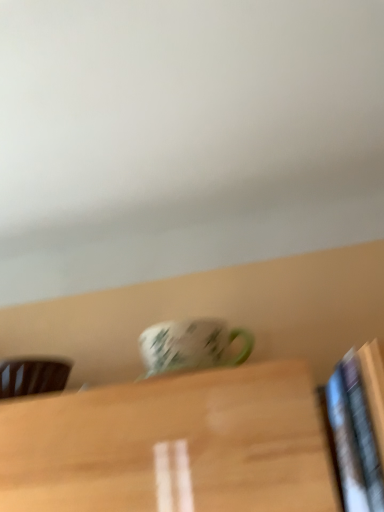
Question: Considering the positions of green matte mug at center and brown wood chair at left in the image, is green matte mug at center bigger or smaller than brown wood chair at left?

Choices:
 (A) small
 (B) big

Answer: (B)

Question: Is point (198, 353) positioned closer to the camera than point (59, 377)?

Choices:
 (A) farther
 (B) closer

Answer: (B)

Question: Is green matte mug at center in front of or behind brown wood chair at left in the image?

Choices:
 (A) front
 (B) behind

Answer: (A)

Question: Is brown wood chair at left taller or shorter than green matte mug at center?

Choices:
 (A) short
 (B) tall

Answer: (A)

Question: Is point (29, 390) positioned closer to the camera than point (198, 366)?

Choices:
 (A) closer
 (B) farther

Answer: (B)

Question: Is brown wood chair at left in front of or behind green matte mug at center in the image?

Choices:
 (A) behind
 (B) front

Answer: (A)

Question: From the image's perspective, is brown wood chair at left above or below green matte mug at center?

Choices:
 (A) above
 (B) below

Answer: (B)